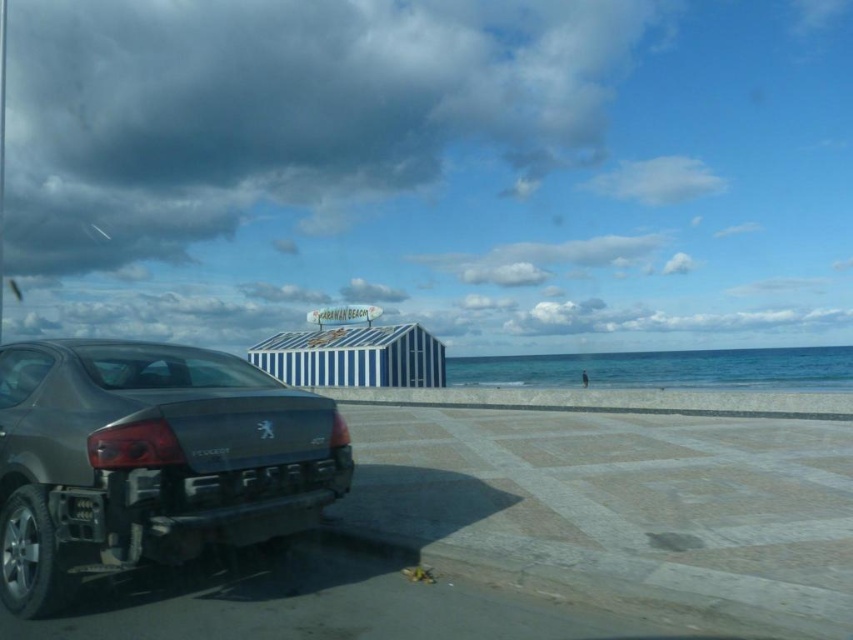
Is white sand beach at lower right taller than black plastic license plate at lower left?

Yes, white sand beach at lower right is taller than black plastic license plate at lower left.

Consider the image. Is white sand beach at lower right shorter than black plastic license plate at lower left?

No, white sand beach at lower right is not shorter than black plastic license plate at lower left.

Find the location of a particular element. The image size is (853, 640). white sand beach at lower right is located at coordinates (618, 497).

In the scene shown: Is white sand beach at lower right bigger than matte gray car at lower left?

Correct, white sand beach at lower right is larger in size than matte gray car at lower left.

Is white sand beach at lower right shorter than matte gray car at lower left?

Yes, white sand beach at lower right is shorter than matte gray car at lower left.

This screenshot has height=640, width=853. Describe the element at coordinates (618, 497) in the screenshot. I see `white sand beach at lower right` at that location.

Find the location of a particular element. Image resolution: width=853 pixels, height=640 pixels. white sand beach at lower right is located at coordinates (618, 497).

Which is in front, point (103, 428) or point (91, 497)?

Point (91, 497) is in front.

Is matte gray car at lower left to the right of black plastic license plate at lower left from the viewer's perspective?

Incorrect, matte gray car at lower left is not on the right side of black plastic license plate at lower left.

Where is `matte gray car at lower left`? The height and width of the screenshot is (640, 853). matte gray car at lower left is located at coordinates (149, 460).